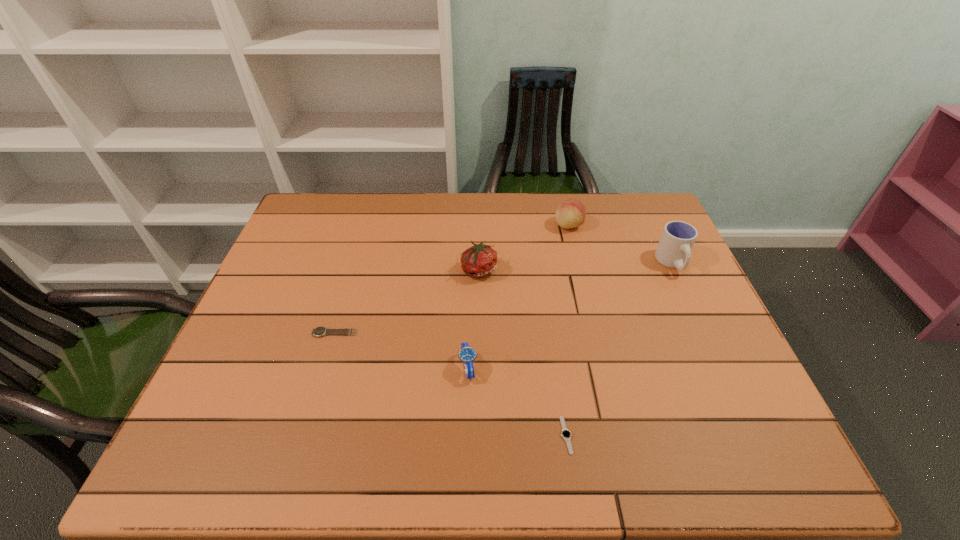
This screenshot has width=960, height=540. What are the coordinates of `the shortest object` in the screenshot? It's located at [566, 434].

Where is `vacant space situated 0.290m with the handle on the side of the rightmost object`? This screenshot has height=540, width=960. vacant space situated 0.290m with the handle on the side of the rightmost object is located at coordinates (719, 362).

Locate an element on the screen. This screenshot has height=540, width=960. free space located on the left of the peach is located at coordinates (492, 225).

Identify the location of free space located on the right of the tomato. The image size is (960, 540). (545, 269).

Where is `free region located 0.200m on the front of the second nearest watch`? The image size is (960, 540). free region located 0.200m on the front of the second nearest watch is located at coordinates (466, 472).

Identify the location of vacant point located 0.340m on the back of the second shortest object. (362, 244).

You are a GUI agent. You are given a task and a screenshot of the screen. Output one action in this format:
    pyautogui.click(x=<x>, y=<y>)
    Task: Click on the free region located on the right of the shortest object
    This screenshot has height=540, width=960.
    Given the screenshot: What is the action you would take?
    pyautogui.click(x=610, y=435)

The image size is (960, 540). In order to click on object present at the far edge in this screenshot , I will do `click(571, 213)`.

Find the location of `object that is at the near edge`. object that is at the near edge is located at coordinates (566, 434).

Where is `object situated at the right edge`? The width and height of the screenshot is (960, 540). object situated at the right edge is located at coordinates (674, 249).